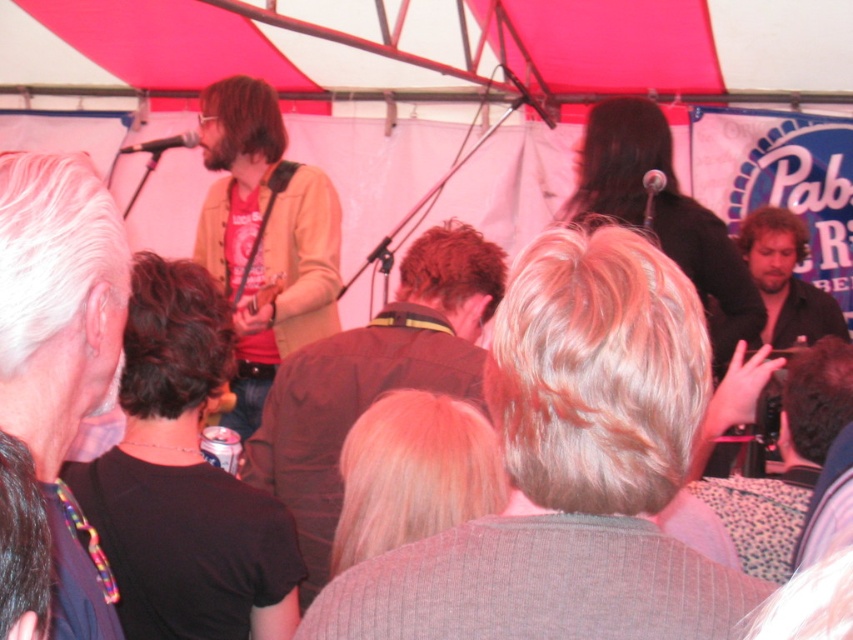
Question: Which point appears farthest from the camera in this image?

Choices:
 (A) (318, 572)
 (B) (77, 600)
 (C) (262, 307)

Answer: (C)

Question: Observing the image, what is the correct spatial positioning of blonde hair at center in reference to gray hair at left?

Choices:
 (A) above
 (B) below

Answer: (B)

Question: Which is nearer to the matte brown jacket at center?

Choices:
 (A) brown leather jacket at center
 (B) black fabric shirt at center
 (C) gray hair at left

Answer: (A)

Question: Can you confirm if brown leather jacket at center is positioned below matte brown jacket at center?

Choices:
 (A) yes
 (B) no

Answer: (A)

Question: Which point is farther to the camera?

Choices:
 (A) matte black microphone at upper left
 (B) matte brown jacket at center

Answer: (A)

Question: Can you confirm if blonde hair at center is positioned to the right of matte brown jacket at center?

Choices:
 (A) no
 (B) yes

Answer: (B)